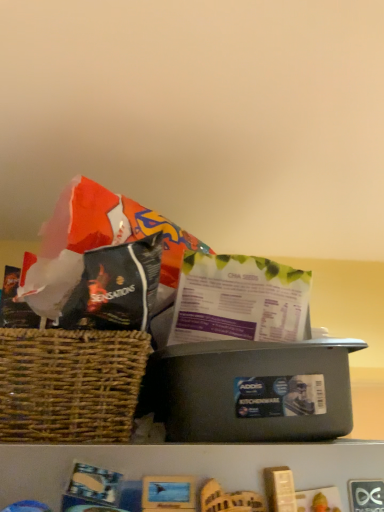
In order to face matte black plastic container at center, should I rotate leftwards or rightwards?

A 6.548 degree turn to the right will do.

Consider the image. What is the approximate height of matte black plastic container at center?

4.99 inches.

The width and height of the screenshot is (384, 512). Describe the element at coordinates (251, 391) in the screenshot. I see `matte black plastic container at center` at that location.

Locate an element on the screen. matte black plastic container at center is located at coordinates (251, 391).

Describe the element at coordinates (239, 300) in the screenshot. I see `green paper gift bag at center` at that location.

You are a GUI agent. You are given a task and a screenshot of the screen. Output one action in this format:
    pyautogui.click(x=<x>, y=<y>)
    Task: Click on the green paper gift bag at center
    This screenshot has width=384, height=512.
    Given the screenshot: What is the action you would take?
    pyautogui.click(x=239, y=300)

Where is `matte black plastic container at center`? The image size is (384, 512). matte black plastic container at center is located at coordinates (251, 391).

Considering the relative positions of matte black plastic container at center and green paper gift bag at center in the image provided, is matte black plastic container at center to the left of green paper gift bag at center from the viewer's perspective?

Yes, matte black plastic container at center is to the left of green paper gift bag at center.

Is matte black plastic container at center behind green paper gift bag at center?

No, it is in front of green paper gift bag at center.

Considering the points (342, 411) and (277, 289), which point is behind, point (342, 411) or point (277, 289)?

The point (277, 289) is farther from the camera.

From the image's perspective, is matte black plastic container at center above or below green paper gift bag at center?

From the image's perspective, matte black plastic container at center appears below green paper gift bag at center.

From a real-world perspective, who is located higher, matte black plastic container at center or green paper gift bag at center?

green paper gift bag at center.

Between matte black plastic container at center and green paper gift bag at center, which one has smaller width?

Thinner between the two is green paper gift bag at center.

Considering the sizes of matte black plastic container at center and green paper gift bag at center in the image, is matte black plastic container at center taller or shorter than green paper gift bag at center?

matte black plastic container at center is taller than green paper gift bag at center.

Considering the sizes of objects matte black plastic container at center and green paper gift bag at center in the image provided, who is smaller, matte black plastic container at center or green paper gift bag at center?

green paper gift bag at center is smaller.

Is matte black plastic container at center surrounding green paper gift bag at center?

No, green paper gift bag at center is not inside matte black plastic container at center.

Is matte black plastic container at center next to green paper gift bag at center and touching it?

Yes, matte black plastic container at center and green paper gift bag at center clearly make contact.

Is matte black plastic container at center facing towards green paper gift bag at center?

No, matte black plastic container at center is not facing towards green paper gift bag at center.

In the scene shown: How different are the orientations of matte black plastic container at center and green paper gift bag at center in degrees?

matte black plastic container at center and green paper gift bag at center are facing 21.4 degrees away from each other.

Measure the distance from matte black plastic container at center to green paper gift bag at center.

matte black plastic container at center and green paper gift bag at center are 3.16 inches apart.

This screenshot has height=512, width=384. I want to click on box that is on the left side of green paper gift bag at center, so click(x=251, y=391).

Between green paper gift bag at center and matte black plastic container at center, which one appears on the right side from the viewer's perspective?

From the viewer's perspective, green paper gift bag at center appears more on the right side.

Is green paper gift bag at center further to camera compared to matte black plastic container at center?

Yes, green paper gift bag at center is further from the camera.

Which point is more forward, (171, 339) or (268, 361)?

Result: The point (268, 361) is more forward.

From the image's perspective, which is below, green paper gift bag at center or matte black plastic container at center?

matte black plastic container at center is shown below in the image.

From a real-world perspective, is green paper gift bag at center under matte black plastic container at center?

A: Incorrect, from a real-world perspective, green paper gift bag at center is higher than matte black plastic container at center.

Can you confirm if green paper gift bag at center is thinner than matte black plastic container at center?

Correct, the width of green paper gift bag at center is less than that of matte black plastic container at center.

Considering the sizes of green paper gift bag at center and matte black plastic container at center in the image, is green paper gift bag at center taller or shorter than matte black plastic container at center?

Clearly, green paper gift bag at center is shorter compared to matte black plastic container at center.

Does green paper gift bag at center have a smaller size compared to matte black plastic container at center?

Correct, green paper gift bag at center occupies less space than matte black plastic container at center.

Can matte black plastic container at center be found inside green paper gift bag at center?

No, matte black plastic container at center is not a part of green paper gift bag at center.

Would you consider green paper gift bag at center to be distant from matte black plastic container at center?

No, green paper gift bag at center is not far from matte black plastic container at center.

Does green paper gift bag at center turn towards matte black plastic container at center?

No.

Can you tell me how much green paper gift bag at center and matte black plastic container at center differ in facing direction?

green paper gift bag at center and matte black plastic container at center are facing 21.4 degrees away from each other.

You are a GUI agent. You are given a task and a screenshot of the screen. Output one action in this format:
    pyautogui.click(x=<x>, y=<y>)
    Task: Click on the box below the green paper gift bag at center (from the image's perspective)
    
    Given the screenshot: What is the action you would take?
    pyautogui.click(x=251, y=391)

The width and height of the screenshot is (384, 512). Identify the location of gift bag lying behind the matte black plastic container at center. (239, 300).

At what (x,y) coordinates should I click in order to perform the action: click on box below the green paper gift bag at center (from the image's perspective). Please return your answer as a coordinate pair (x, y). The width and height of the screenshot is (384, 512). Looking at the image, I should click on tap(251, 391).